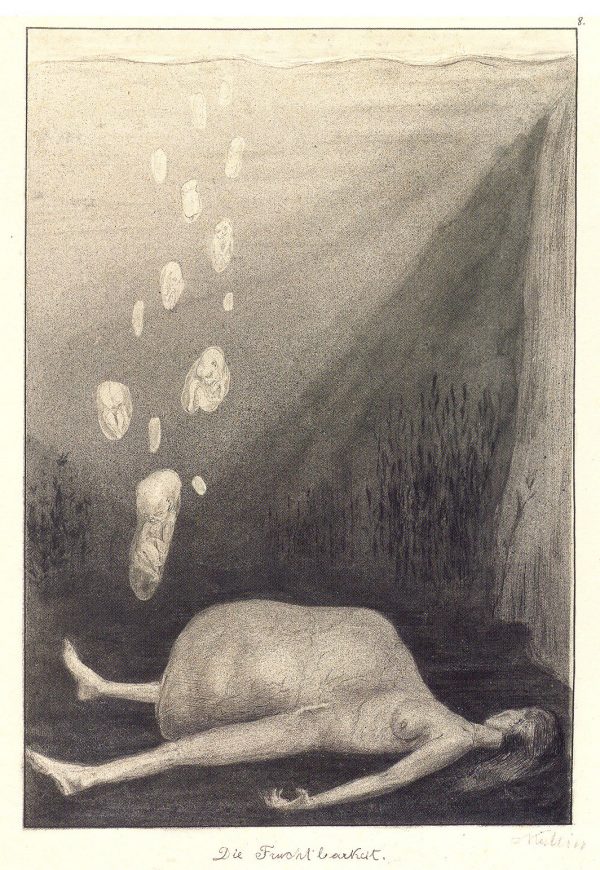
I want to click on art, so click(480, 605).